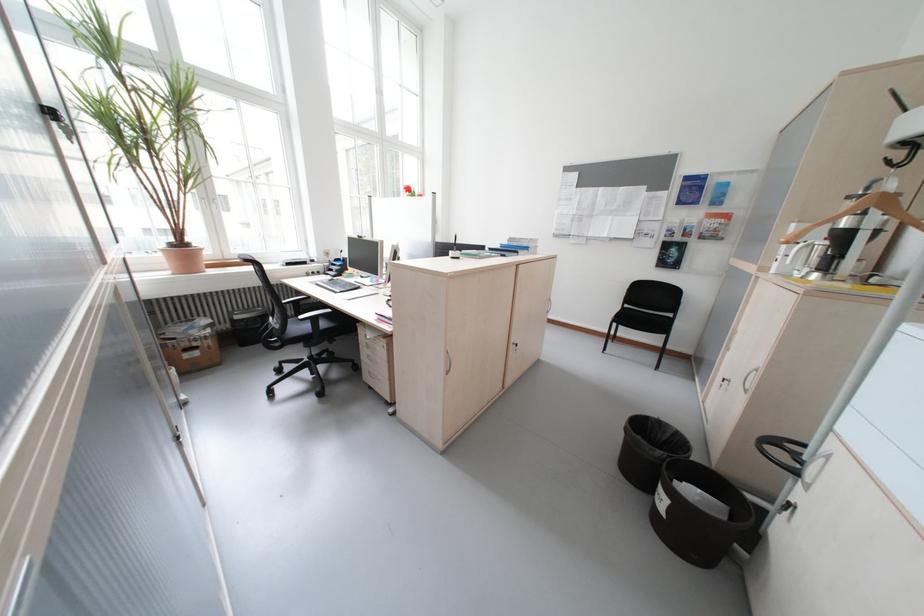
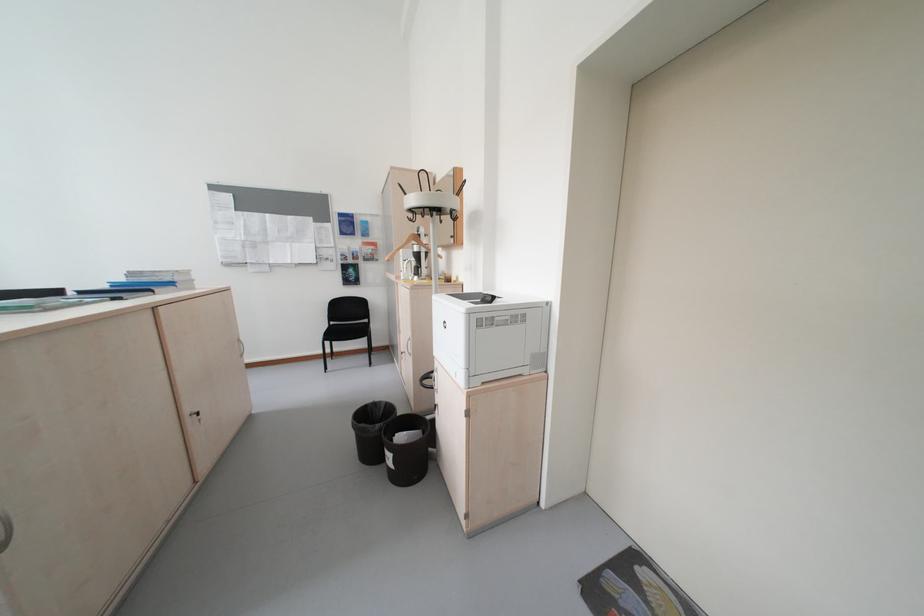
Question: How did the camera likely rotate?

Choices:
 (A) Left
 (B) Right
 (C) Up
 (D) Down

Answer: (B)